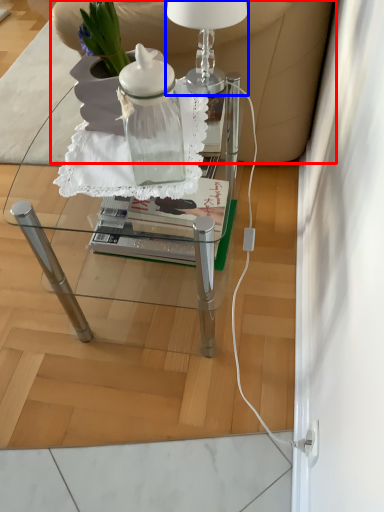
Question: Which object appears farthest to the camera in this image, armchair (highlighted by a red box) or table lamp (highlighted by a blue box)?

Choices:
 (A) armchair
 (B) table lamp

Answer: (A)